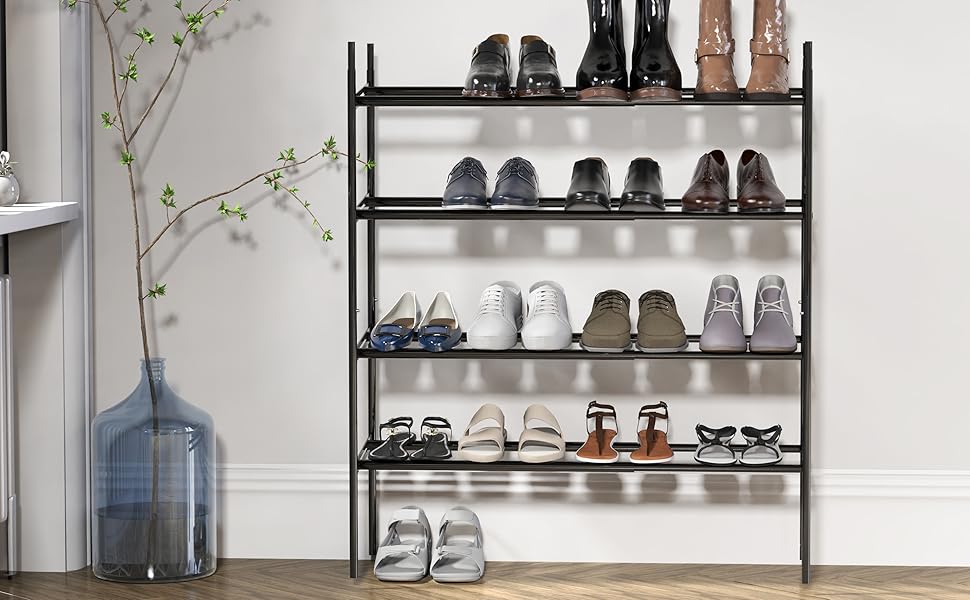
Image resolution: width=970 pixels, height=600 pixels. I want to click on boots on top shelf, so click(608, 51), click(644, 59), click(715, 66), click(760, 71).